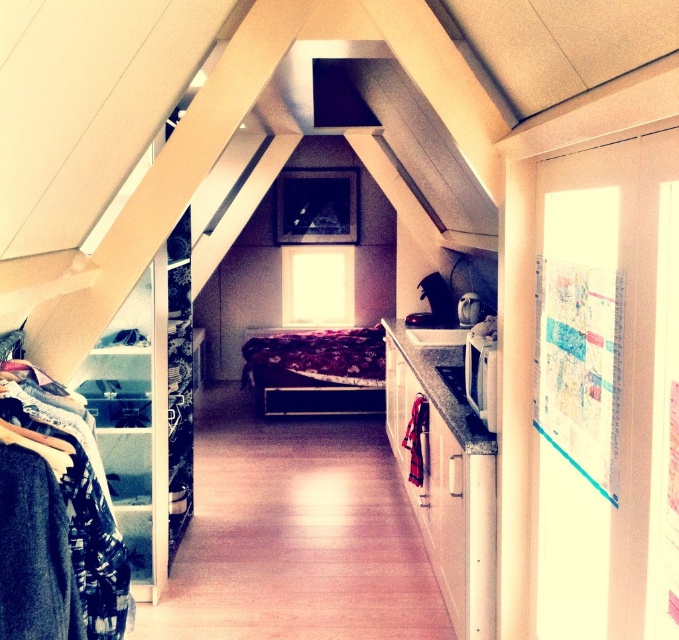
Question: Among these points, which one is nearest to the camera?

Choices:
 (A) (280, 412)
 (B) (22, 621)
 (C) (69, 545)

Answer: (B)

Question: Which of the following is the closest to the observer?

Choices:
 (A) dark blue wool sweater at left
 (B) floral-patterned fabric bed at center
 (C) flannel shirt at left

Answer: (A)

Question: Does dark blue wool sweater at left come behind floral-patterned fabric bed at center?

Choices:
 (A) yes
 (B) no

Answer: (B)

Question: Is flannel shirt at left positioned before dark blue wool sweater at left?

Choices:
 (A) yes
 (B) no

Answer: (B)

Question: Is dark blue wool sweater at left in front of floral-patterned fabric bed at center?

Choices:
 (A) no
 (B) yes

Answer: (B)

Question: Which point appears closest to the camera in this image?

Choices:
 (A) (75, 500)
 (B) (22, 580)

Answer: (B)